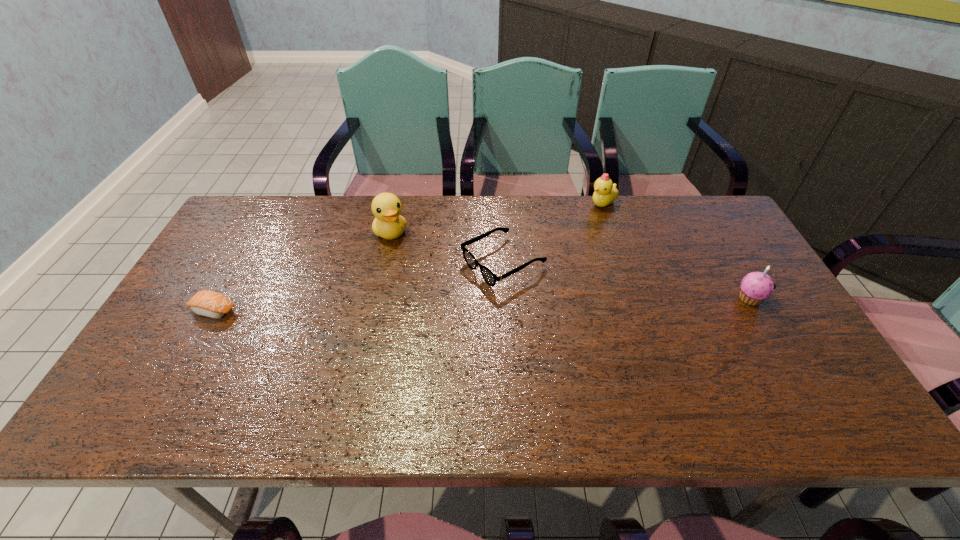
Locate an element on the screen. This screenshot has width=960, height=540. the leftmost object is located at coordinates point(207,303).

This screenshot has width=960, height=540. Find the location of `sushi`. sushi is located at coordinates (207, 303).

Identify the location of cupcake. The image size is (960, 540). (756, 286).

You are a GUI agent. You are given a task and a screenshot of the screen. Output one action in this format:
    pyautogui.click(x=<x>, y=<y>)
    Task: Click on the second shortest object
    The height and width of the screenshot is (540, 960).
    Given the screenshot: What is the action you would take?
    pyautogui.click(x=490, y=278)

This screenshot has height=540, width=960. In order to click on the third object from left to right in this screenshot , I will do `click(490, 278)`.

The width and height of the screenshot is (960, 540). I want to click on the tallest object, so click(389, 224).

The width and height of the screenshot is (960, 540). I want to click on the fourth object from right to left, so click(x=389, y=224).

You are a GUI agent. You are given a task and a screenshot of the screen. Output one action in this format:
    pyautogui.click(x=<x>, y=<y>)
    Task: Click on the duckling
    This screenshot has width=960, height=540.
    Given the screenshot: What is the action you would take?
    pyautogui.click(x=606, y=192)

Identify the location of the farthest object. 606,192.

This screenshot has height=540, width=960. What are the coordinates of `vacant point located 0.090m on the right of the shortest object` in the screenshot? It's located at (272, 310).